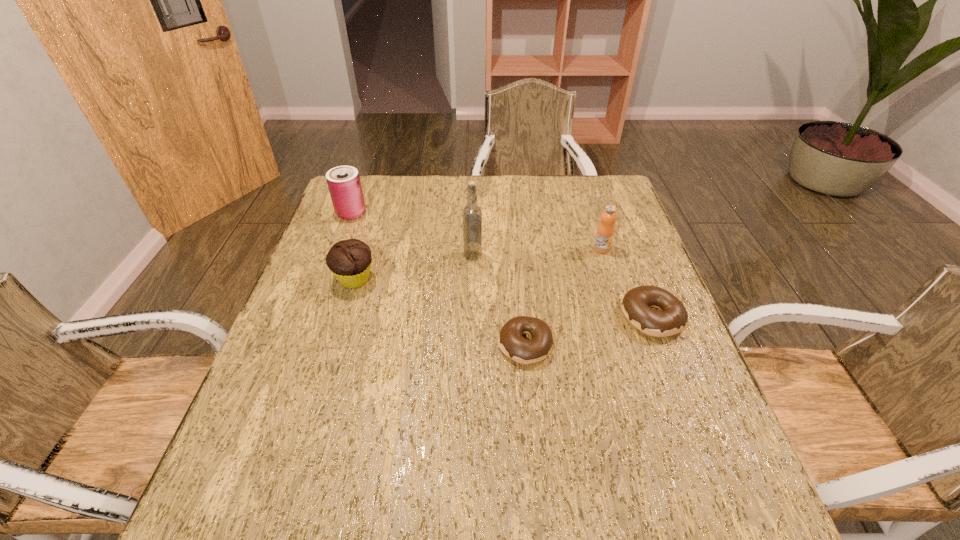
Where is `free space that satisfies the following two spatial constraints: 1. on the front side of the can; 2. on the left side of the muffin`? free space that satisfies the following two spatial constraints: 1. on the front side of the can; 2. on the left side of the muffin is located at coordinates (326, 279).

Where is `free region that satisfies the following two spatial constraints: 1. on the front label of the taller doughnut; 2. on the right side of the orange juice`? The image size is (960, 540). free region that satisfies the following two spatial constraints: 1. on the front label of the taller doughnut; 2. on the right side of the orange juice is located at coordinates (623, 317).

Find the location of a particular element. blank area in the image that satisfies the following two spatial constraints: 1. on the label of the tallest object; 2. on the right side of the left doughnut is located at coordinates (471, 345).

Locate an element on the screen. vacant space that satisfies the following two spatial constraints: 1. on the front side of the can; 2. on the right side of the fifth tallest object is located at coordinates (312, 317).